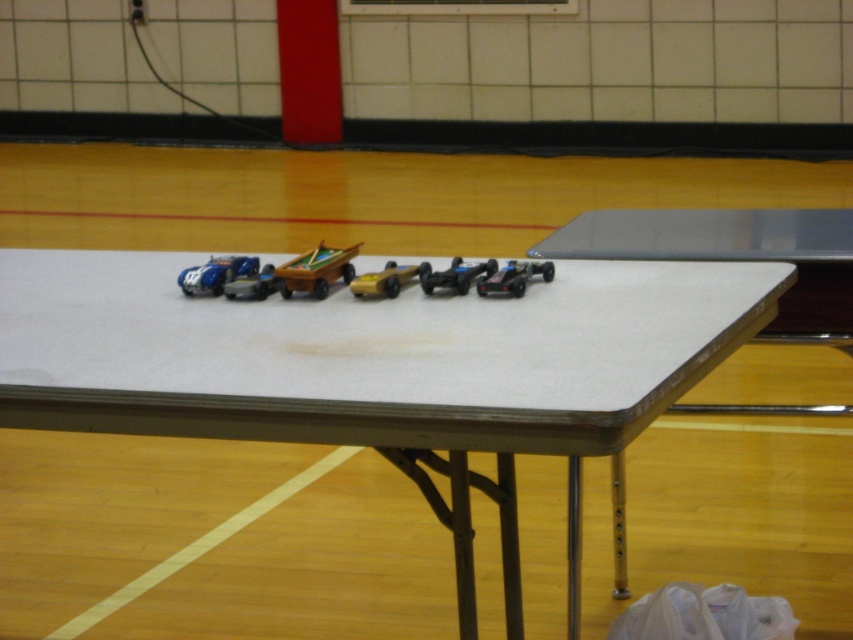
Question: Does white matte table at center appear under shiny blue plastic toy car at left?

Choices:
 (A) yes
 (B) no

Answer: (A)

Question: Can you confirm if shiny blue plastic toy car at left is smaller than gold metallic car at center?

Choices:
 (A) yes
 (B) no

Answer: (B)

Question: Which object appears closest to the camera in this image?

Choices:
 (A) white matte table at center
 (B) black plastic car at center
 (C) shiny blue plastic toy car at left

Answer: (A)

Question: Estimate the real-world distances between objects in this image. Which object is closer to the wooden toy car at center?

Choices:
 (A) black plastic car at center
 (B) gold metallic car at center
 (C) shiny blue plastic toy car at left
 (D) white matte table at center

Answer: (B)

Question: Is white matte table at center closer to the viewer compared to gold metallic car at center?

Choices:
 (A) no
 (B) yes

Answer: (B)

Question: Which is farther from the gold metallic car at center?

Choices:
 (A) white matte table at center
 (B) black plastic car at center

Answer: (A)